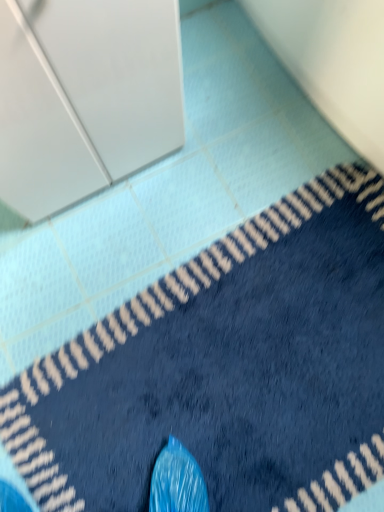
Question: Can you confirm if white glossy cabinet at upper left is bigger than blue plush bath mat at lower right?

Choices:
 (A) no
 (B) yes

Answer: (B)

Question: From a real-world perspective, is white glossy cabinet at upper left over blue plush bath mat at lower right?

Choices:
 (A) no
 (B) yes

Answer: (B)

Question: From the image's perspective, would you say white glossy cabinet at upper left is shown under blue plush bath mat at lower right?

Choices:
 (A) yes
 (B) no

Answer: (B)

Question: Does white glossy cabinet at upper left have a lesser height compared to blue plush bath mat at lower right?

Choices:
 (A) yes
 (B) no

Answer: (B)

Question: Does white glossy cabinet at upper left have a greater height compared to blue plush bath mat at lower right?

Choices:
 (A) yes
 (B) no

Answer: (A)

Question: Is the depth of white glossy cabinet at upper left less than that of blue plush bath mat at lower right?

Choices:
 (A) yes
 (B) no

Answer: (A)

Question: Is there a large distance between blue plush bath mat at lower right and white glossy cabinet at upper left?

Choices:
 (A) yes
 (B) no

Answer: (B)

Question: Does blue plush bath mat at lower right have a lesser height compared to white glossy cabinet at upper left?

Choices:
 (A) no
 (B) yes

Answer: (B)

Question: From the image's perspective, is blue plush bath mat at lower right above white glossy cabinet at upper left?

Choices:
 (A) no
 (B) yes

Answer: (A)

Question: Can you confirm if blue plush bath mat at lower right is positioned to the right of white glossy cabinet at upper left?

Choices:
 (A) yes
 (B) no

Answer: (A)

Question: Is white glossy cabinet at upper left at the back of blue plush bath mat at lower right?

Choices:
 (A) yes
 (B) no

Answer: (B)

Question: Can you confirm if blue plush bath mat at lower right is wider than white glossy cabinet at upper left?

Choices:
 (A) no
 (B) yes

Answer: (B)

Question: Considering the positions of blue plush bath mat at lower right and white glossy cabinet at upper left in the image, is blue plush bath mat at lower right bigger or smaller than white glossy cabinet at upper left?

Choices:
 (A) small
 (B) big

Answer: (A)